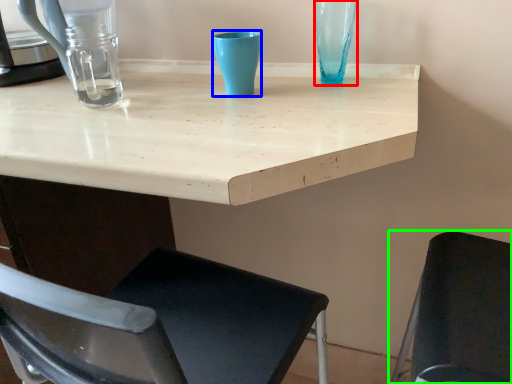
Question: Which object is the farthest from glass vase (highlighted by a red box)? Choose among these: turquoise (highlighted by a blue box) or chair (highlighted by a green box).

Choices:
 (A) turquoise
 (B) chair

Answer: (B)